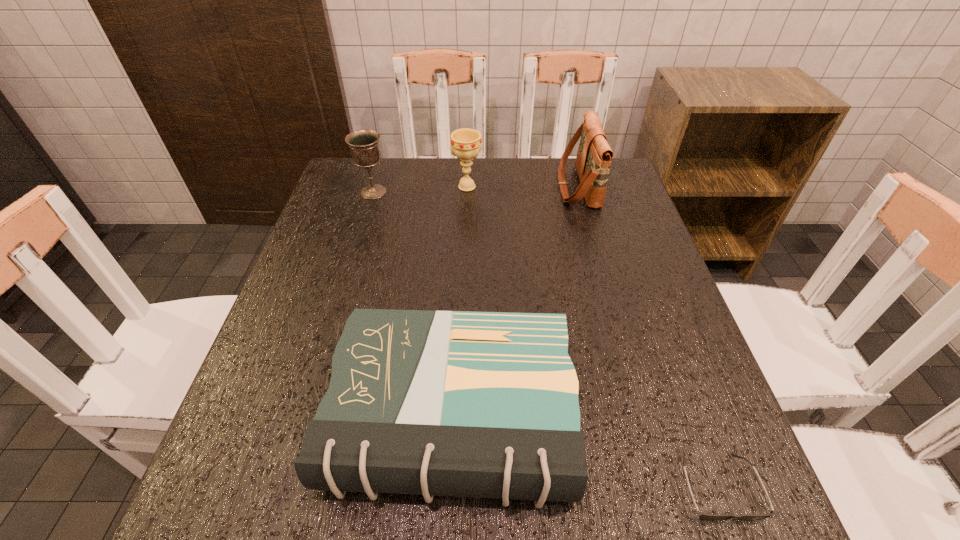
Identify the location of free space at the far edge of the desktop. (436, 157).

Locate an element on the screen. Image resolution: width=960 pixels, height=540 pixels. free spot at the left edge of the desktop is located at coordinates (348, 310).

At what (x,y) coordinates should I click in order to perform the action: click on vacant space at the right edge of the desktop. Please return your answer as a coordinate pair (x, y). The image size is (960, 540). Looking at the image, I should click on (698, 348).

Locate an element on the screen. vacant area at the near left corner is located at coordinates (254, 504).

You are a GUI agent. You are given a task and a screenshot of the screen. Output one action in this format:
    pyautogui.click(x=<x>, y=<y>)
    Task: Click on the vacant region at the far right corner
    Image resolution: width=960 pixels, height=540 pixels.
    Given the screenshot: What is the action you would take?
    pyautogui.click(x=625, y=190)

Image resolution: width=960 pixels, height=540 pixels. I want to click on free space between the right chalice and the shortest object, so click(592, 336).

In order to click on free space between the shoulder bag and the sunglasses in this screenshot , I will do `click(648, 336)`.

Locate an element on the screen. The image size is (960, 540). vacant space that is in between the shoulder bag and the right chalice is located at coordinates (522, 187).

Locate an element on the screen. vacant space that's between the shortest object and the right chalice is located at coordinates (592, 336).

Identify the location of vacant area that lies between the shortest object and the shoulder bag. The height and width of the screenshot is (540, 960). (648, 336).